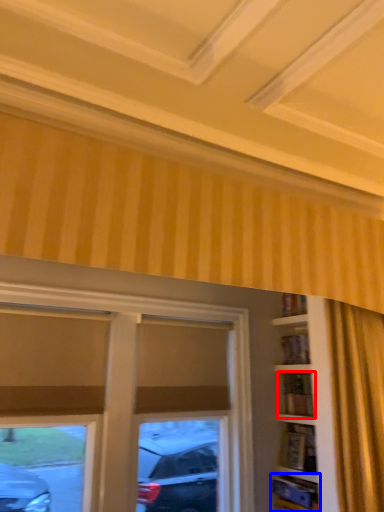
Question: Which of the following is the closest to the observer, shelf (highlighted by a red box) or shelf (highlighted by a blue box)?

Choices:
 (A) shelf
 (B) shelf

Answer: (B)